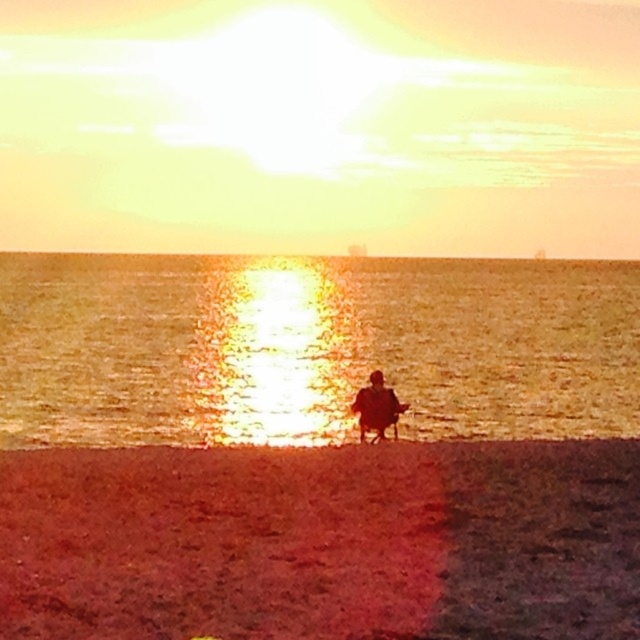
Question: Estimate the real-world distances between objects in this image. Which object is farther from the brown sandy beach at lower center?

Choices:
 (A) shiny golden water at center
 (B) silhouette figure at center

Answer: (A)

Question: Which of the following is the farthest from the observer?

Choices:
 (A) shiny golden water at center
 (B) silhouette figure at center
 (C) brown sandy beach at lower center

Answer: (B)

Question: Among these points, which one is nearest to the camera?

Choices:
 (A) (292, 545)
 (B) (378, 388)

Answer: (A)

Question: From the image, what is the correct spatial relationship of shiny golden water at center in relation to silhouette figure at center?

Choices:
 (A) below
 (B) above

Answer: (B)

Question: Does brown sandy beach at lower center have a lesser width compared to shiny golden water at center?

Choices:
 (A) no
 (B) yes

Answer: (B)

Question: Observing the image, what is the correct spatial positioning of shiny golden water at center in reference to silhouette figure at center?

Choices:
 (A) below
 (B) above

Answer: (B)